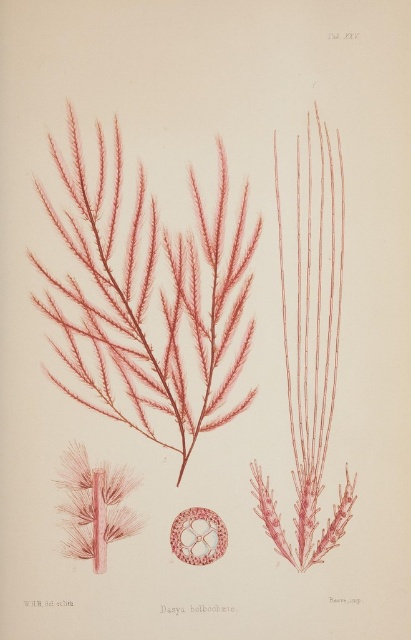
Question: Can you confirm if matte red seaweed at center is thinner than translucent pink filamentous structure at center?

Choices:
 (A) yes
 (B) no

Answer: (B)

Question: Which object is closer to the camera taking this photo?

Choices:
 (A) matte red seaweed at center
 (B) translucent pink filamentous structure at center

Answer: (A)

Question: Among these objects, which one is farthest from the camera?

Choices:
 (A) matte red seaweed at center
 (B) translucent pink filamentous structure at center

Answer: (B)

Question: Where is matte red seaweed at center located in relation to translucent pink filamentous structure at center in the image?

Choices:
 (A) above
 (B) below

Answer: (A)

Question: Which point is farther to the camera?

Choices:
 (A) (224, 157)
 (B) (196, 534)

Answer: (A)

Question: Can you confirm if matte red seaweed at center is positioned to the left of translucent pink filamentous structure at center?

Choices:
 (A) no
 (B) yes

Answer: (B)